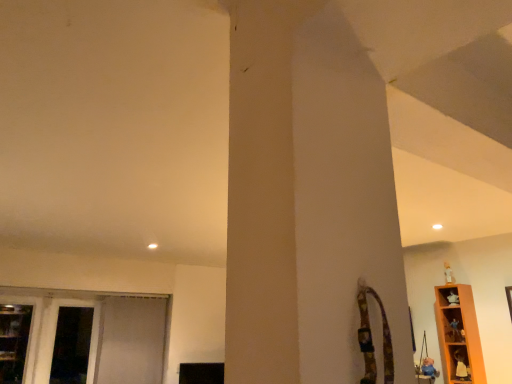
Question: Is white fabric screen door at lower left, positioned as the second screen door in left-to-right order, wider or thinner than wooden shelf at lower right, which is the first shelf from bottom to top?

Choices:
 (A) wide
 (B) thin

Answer: (A)

Question: Is white fabric screen door at lower left, the first screen door when ordered from right to left, taller or shorter than wooden shelf at lower right, which is the first shelf from bottom to top?

Choices:
 (A) short
 (B) tall

Answer: (B)

Question: Estimate the real-world distances between objects in this image. Which object is closer to the white fabric screen door at left, which is the 1th screen door in left-to-right order?

Choices:
 (A) wooden shelf at lower right, which is the 2th shelf in top-to-bottom order
 (B) orange wood shelf at right, the 2th shelf from the bottom
 (C) white fabric screen door at lower left, the first screen door when ordered from right to left

Answer: (C)

Question: Which of these objects is positioned closest to the white fabric screen door at lower left, the first screen door when ordered from right to left?

Choices:
 (A) white fabric screen door at left, which is the 1th screen door in left-to-right order
 (B) wooden shelf at lower right, which is the 2th shelf in top-to-bottom order
 (C) orange wood shelf at right, the 2th shelf from the bottom

Answer: (A)